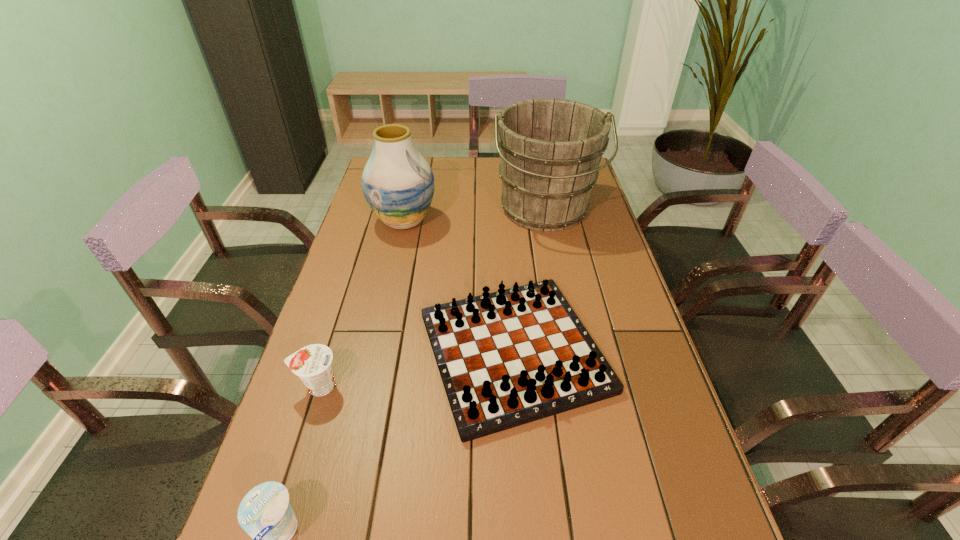
Find the location of a particular element. The image size is (960, 540). yogurt that is positioned at the left edge is located at coordinates (313, 364).

Identify the location of bucket that is at the right edge. (550, 150).

The height and width of the screenshot is (540, 960). Identify the location of chessboard that is at the right edge. (507, 358).

I want to click on object positioned at the far right corner, so pyautogui.click(x=550, y=150).

In order to click on vacant area at the far edge in this screenshot , I will do `click(496, 163)`.

Image resolution: width=960 pixels, height=540 pixels. I want to click on vacant space at the left edge of the desktop, so click(x=330, y=318).

Where is `vacant space at the right edge of the desktop`? The width and height of the screenshot is (960, 540). vacant space at the right edge of the desktop is located at coordinates (684, 526).

Find the location of a particular element. This screenshot has height=540, width=960. free space between the chessboard and the bucket is located at coordinates (529, 281).

Image resolution: width=960 pixels, height=540 pixels. What are the coordinates of `free space between the vase and the chessboard` in the screenshot? It's located at (459, 286).

This screenshot has width=960, height=540. In order to click on vacant space in between the bucket and the vase in this screenshot , I will do coord(474,215).